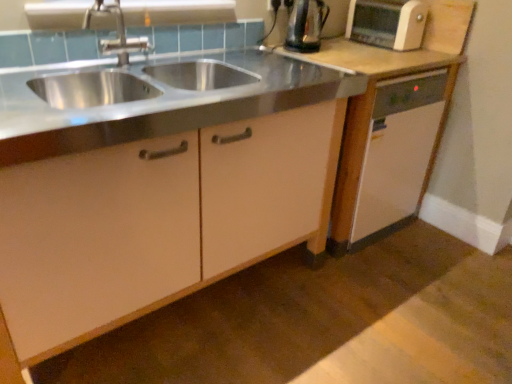
Where is `vacant space underneath metallic silver kettle at upper right (from a real-world perspective)`? vacant space underneath metallic silver kettle at upper right (from a real-world perspective) is located at coordinates (305, 45).